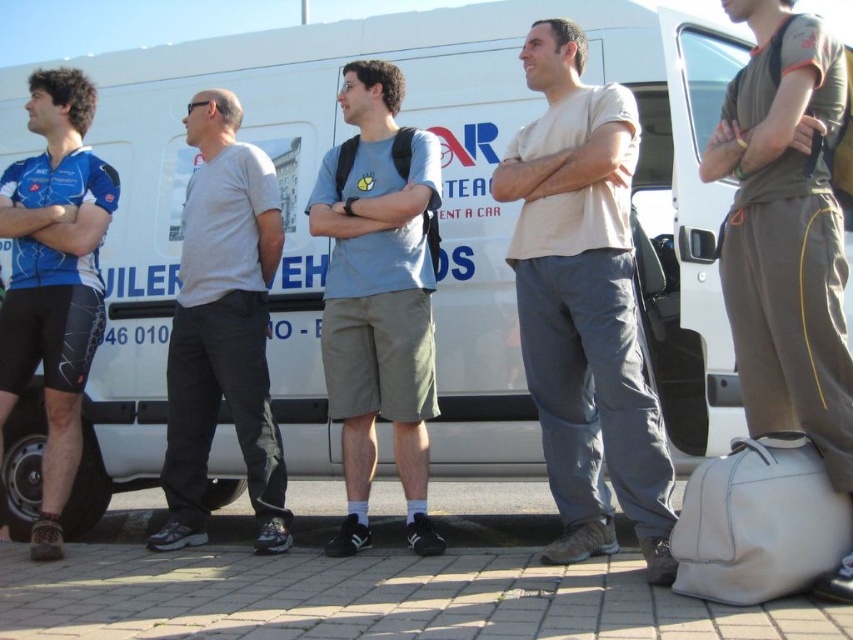
Question: Can you confirm if gray cotton t-shirt at center is smaller than blue jersey at left?

Choices:
 (A) no
 (B) yes

Answer: (A)

Question: Can you confirm if matte gray pants at right is positioned to the right of blue jersey at left?

Choices:
 (A) no
 (B) yes

Answer: (B)

Question: Which object appears closest to the camera in this image?

Choices:
 (A) matte gray pants at right
 (B) light beige cotton t-shirt at center
 (C) light gray cotton t-shirt at center
 (D) blue jersey at left

Answer: (A)

Question: Among these objects, which one is farthest from the camera?

Choices:
 (A) light beige cotton t-shirt at center
 (B) light gray cotton t-shirt at center

Answer: (B)

Question: Is matte gray pants at right above gray cotton t-shirt at center?

Choices:
 (A) no
 (B) yes

Answer: (B)

Question: Which object appears farthest from the camera in this image?

Choices:
 (A) light beige cotton t-shirt at center
 (B) blue jersey at left
 (C) matte gray pants at right

Answer: (B)